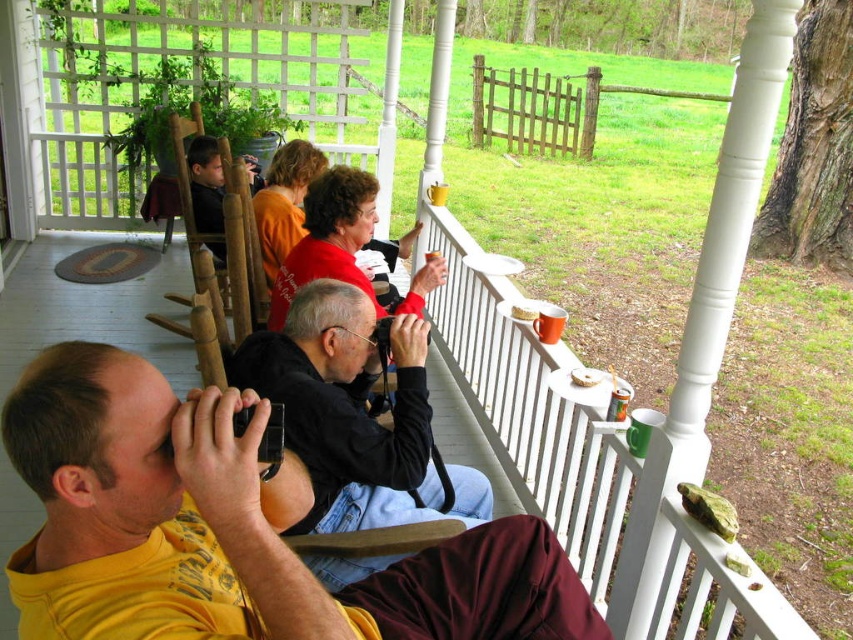
You are standing on the porch and want to walk from point A to point B. The coordinates for point A are point (x=286, y=333) and point B are point (x=245, y=262). Since you want to reach point B quickly, should you walk towards the direction of the person in the yellow shirt or the person in black?

Point (x=286, y=333) is in front of point (x=245, y=262). Therefore, to reach point B quickly, you should walk towards the direction of the person in black.

You are a photographer on the porch. You need to place a white crumbly cake at upper center on a surface that can support its weight. Which object from the scene can you use, considering the black matte jacket at center is larger in size?

The black matte jacket at center has a larger size compared to white crumbly cake at upper center, so it can support the cake as a surface.